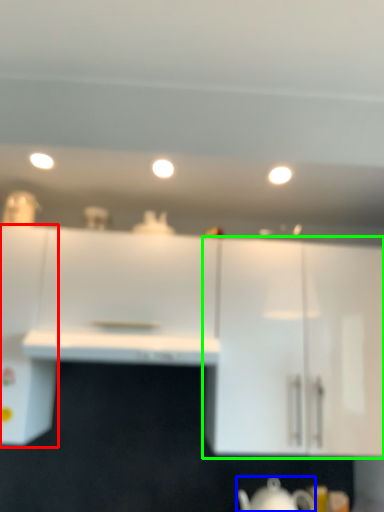
Question: Which object is the closest to the cabinetry (highlighted by a red box)? Choose among these: jug (highlighted by a blue box) or cabinetry (highlighted by a green box).

Choices:
 (A) jug
 (B) cabinetry

Answer: (B)